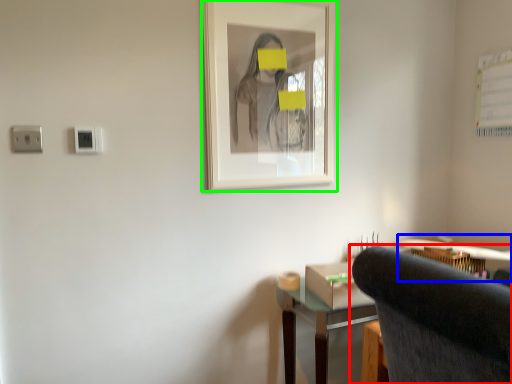
Question: Based on their relative distances, which object is nearer to chair (highlighted by a red box)? Choose from computer desk (highlighted by a blue box) and picture frame (highlighted by a green box).

Choices:
 (A) computer desk
 (B) picture frame

Answer: (B)